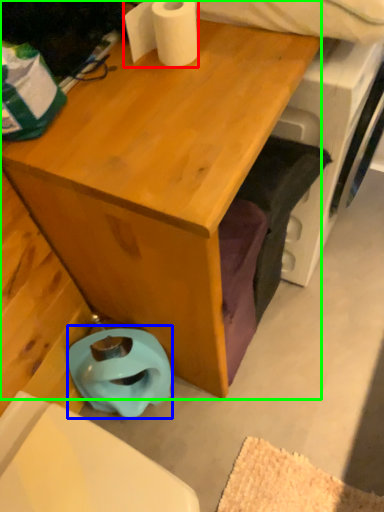
Question: Which object is the closest to the toilet paper (highlighted by a red box)? Choose among these: toilet bowl (highlighted by a blue box) or desk (highlighted by a green box).

Choices:
 (A) toilet bowl
 (B) desk

Answer: (B)